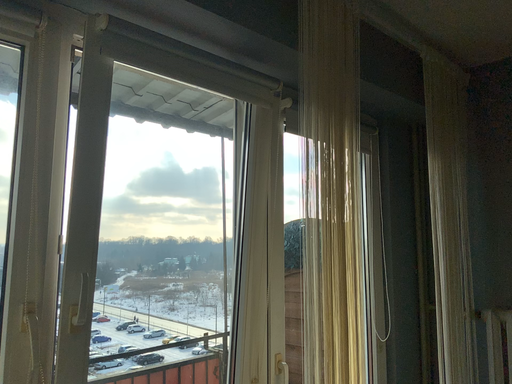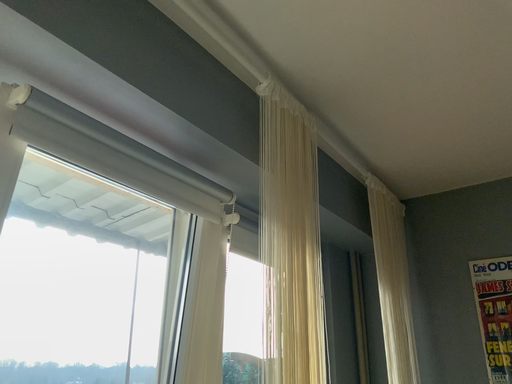
Question: Which way did the camera rotate in the video?

Choices:
 (A) rotated downward
 (B) rotated upward

Answer: (B)